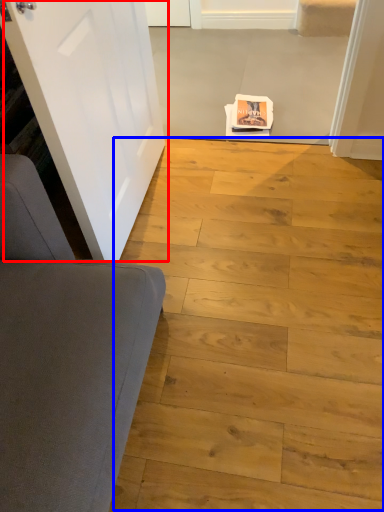
Question: Among these objects, which one is nearest to the camera, door (highlighted by a red box) or plank (highlighted by a blue box)?

Choices:
 (A) door
 (B) plank

Answer: (A)